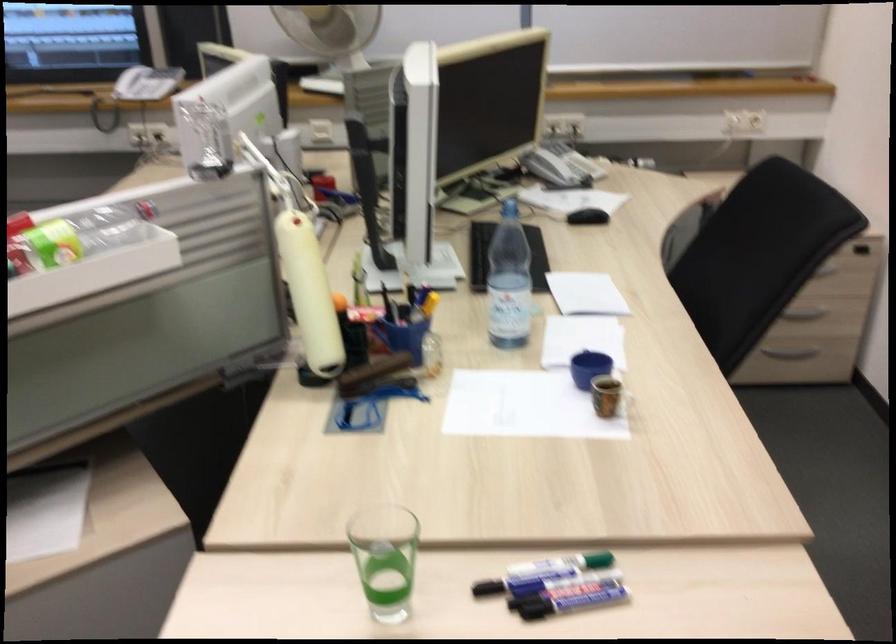
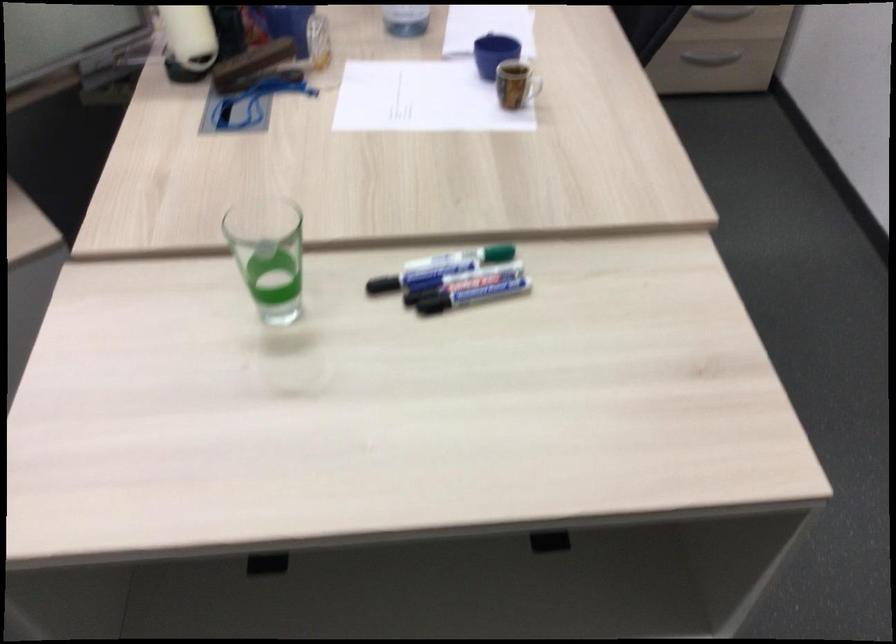
Looking at this image, the images are taken continuously from a first-person perspective. In which direction are you moving?

The cameraman walked toward right, forward.